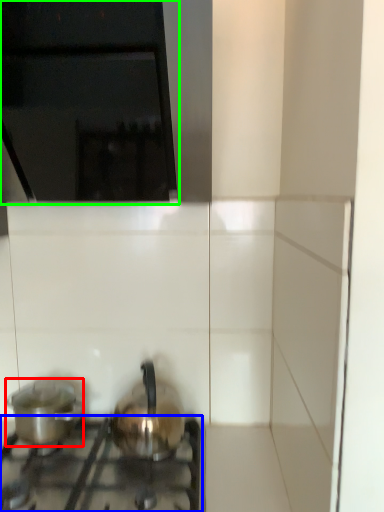
Question: Estimate the real-world distances between objects in this image. Which object is farther from kitchen appliance (highlighted by a red box), gas stove (highlighted by a blue box) or vent (highlighted by a green box)?

Choices:
 (A) gas stove
 (B) vent

Answer: (B)